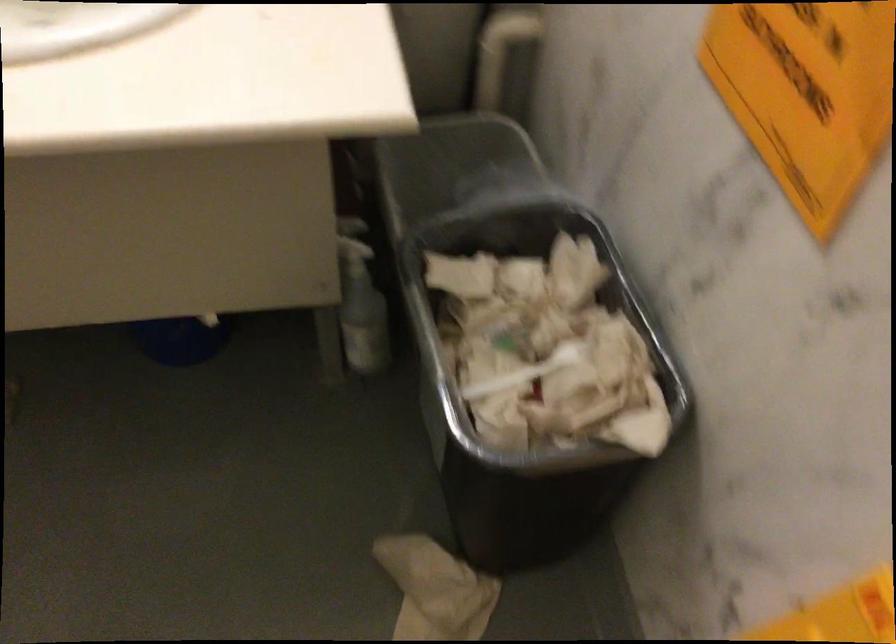
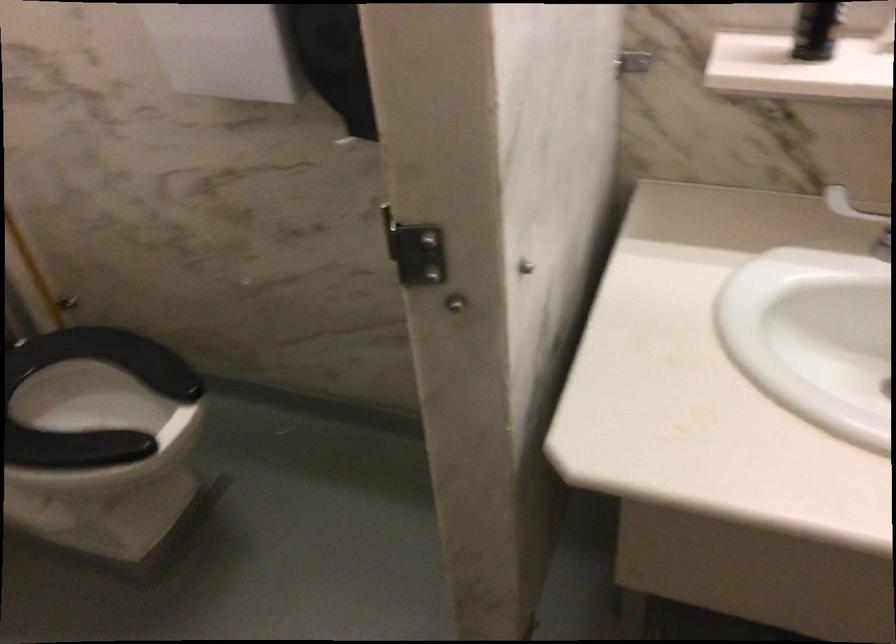
Question: The camera is either moving clockwise (left) or counter-clockwise (right) around the object. The first image is from the beginning of the video and the second image is from the end. Is the camera moving left or right when shooting the video?

Choices:
 (A) Left
 (B) Right

Answer: (B)